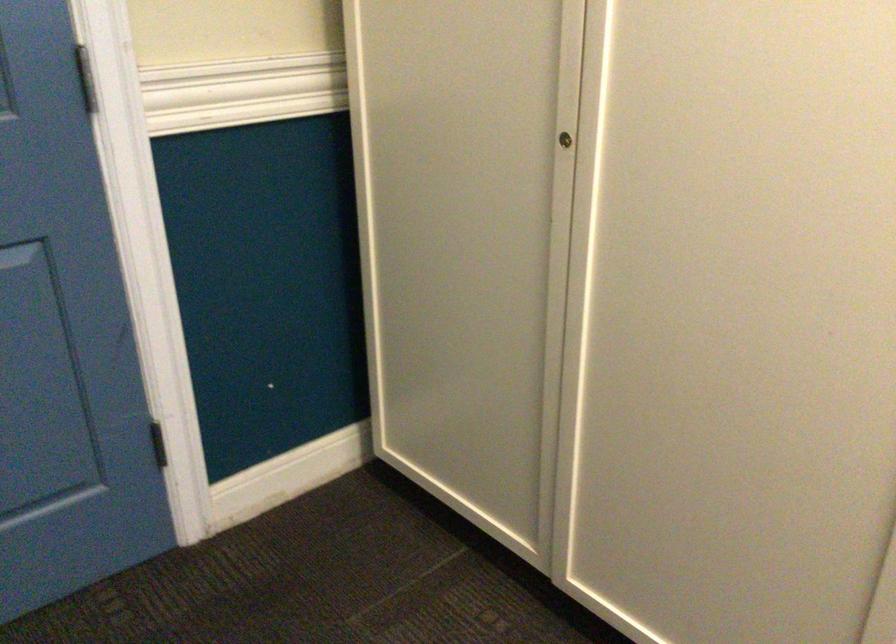
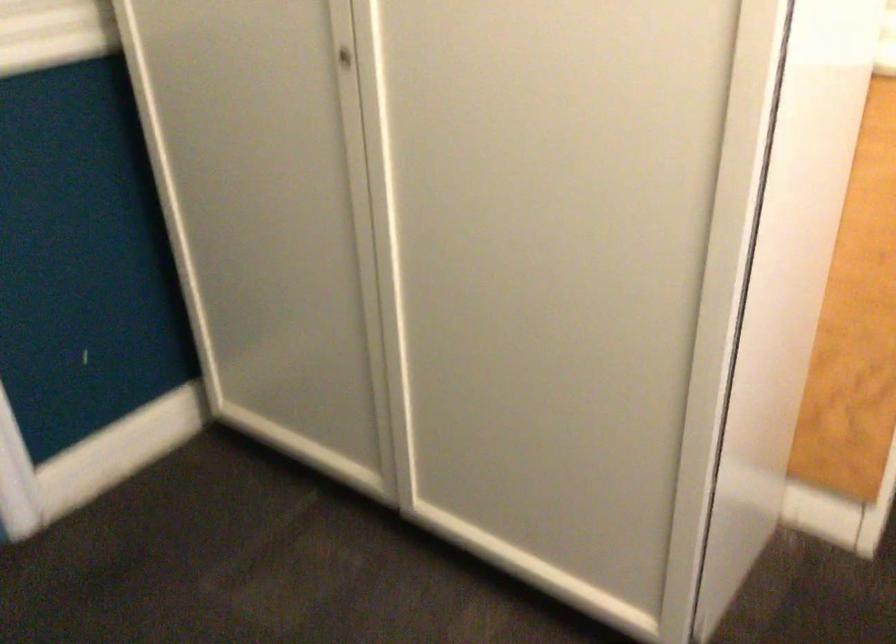
Question: The first image is from the beginning of the video and the second image is from the end. How did the camera likely rotate when shooting the video?

Choices:
 (A) Left
 (B) Right
 (C) Up
 (D) Down

Answer: (B)